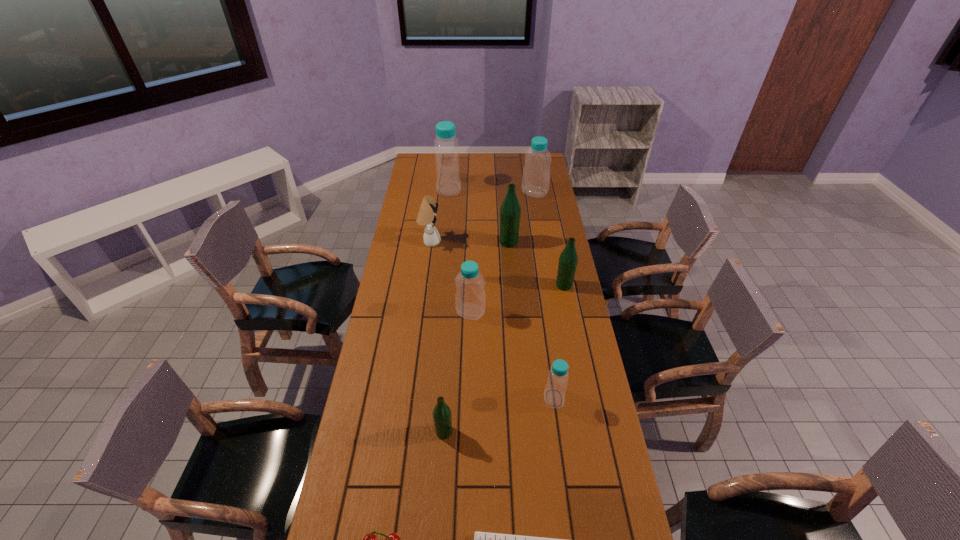
Locate an element on the screen. The height and width of the screenshot is (540, 960). vacant space that satisfies the following two spatial constraints: 1. on the back side of the leftmost green bottle; 2. on the left side of the fourth nearest bottle is located at coordinates (453, 285).

Locate an element on the screen. The width and height of the screenshot is (960, 540). vacant position in the image that satisfies the following two spatial constraints: 1. at the front face of the rightmost green bottle; 2. on the right side of the black doll is located at coordinates (424, 285).

Where is `free spot that satisfies the following two spatial constraints: 1. at the front face of the doll; 2. on the back side of the nearest bottle`? free spot that satisfies the following two spatial constraints: 1. at the front face of the doll; 2. on the back side of the nearest bottle is located at coordinates (404, 432).

Where is `free space in the image that satisfies the following two spatial constraints: 1. on the front side of the leftmost green bottle; 2. on the right side of the leftmost blue bottle`? The height and width of the screenshot is (540, 960). free space in the image that satisfies the following two spatial constraints: 1. on the front side of the leftmost green bottle; 2. on the right side of the leftmost blue bottle is located at coordinates (425, 432).